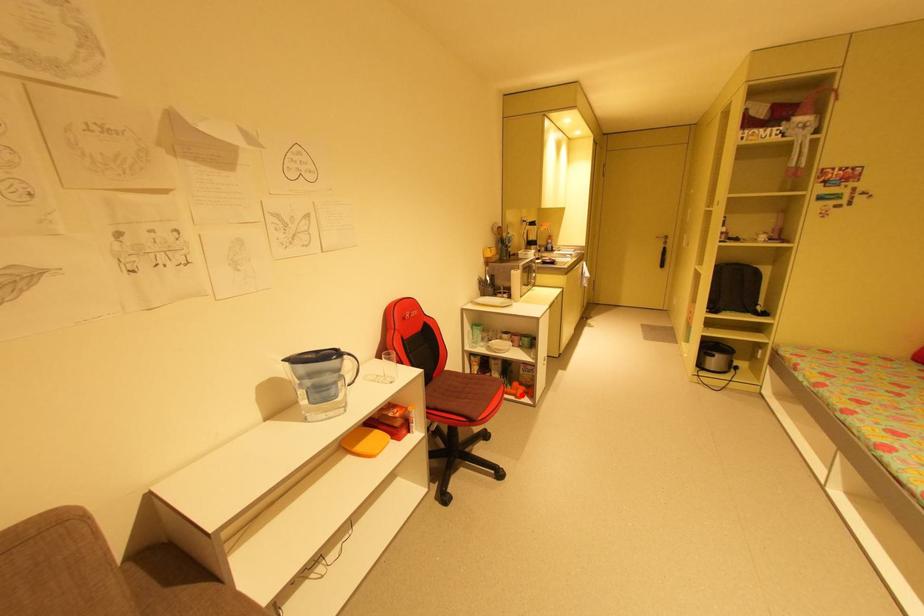
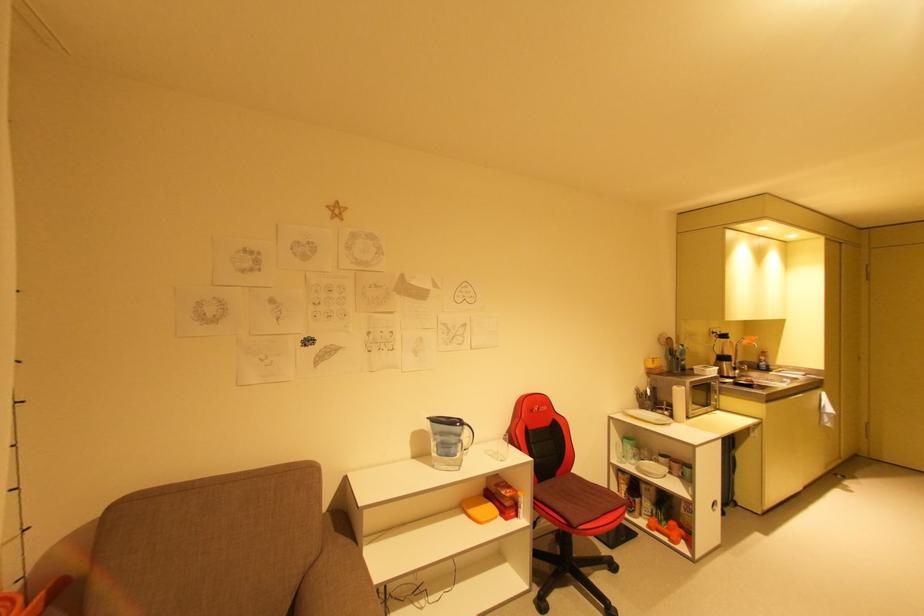
Question: I am providing you with two images of the same scene from different viewpoints. In image1, a red point is highlighted. Considering the same 3D point in image2, which of the following is correct?

Choices:
 (A) It is closer
 (B) It is farther

Answer: (B)